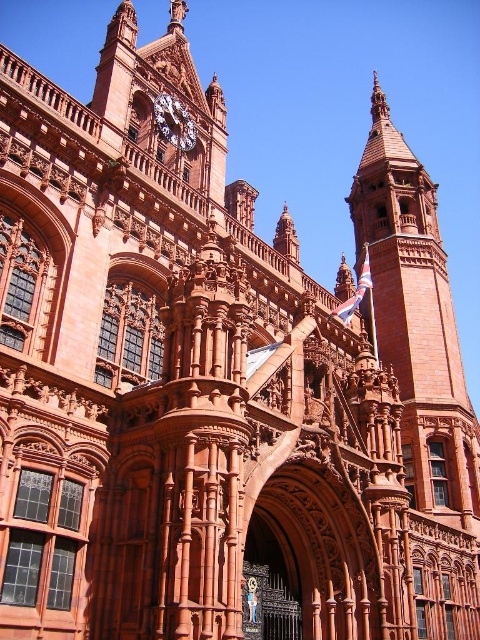
Question: Does brick tower at upper right lie behind polished brass clock at upper center?

Choices:
 (A) yes
 (B) no

Answer: (A)

Question: Among these objects, which one is nearest to the camera?

Choices:
 (A) brick tower at upper right
 (B) polished brass clock at upper center

Answer: (B)

Question: Which of the following is the farthest from the observer?

Choices:
 (A) brick tower at upper right
 (B) polished brass clock at upper center

Answer: (A)

Question: Is brick tower at upper right to the right of polished brass clock at upper center from the viewer's perspective?

Choices:
 (A) no
 (B) yes

Answer: (B)

Question: Is brick tower at upper right wider than polished brass clock at upper center?

Choices:
 (A) yes
 (B) no

Answer: (A)